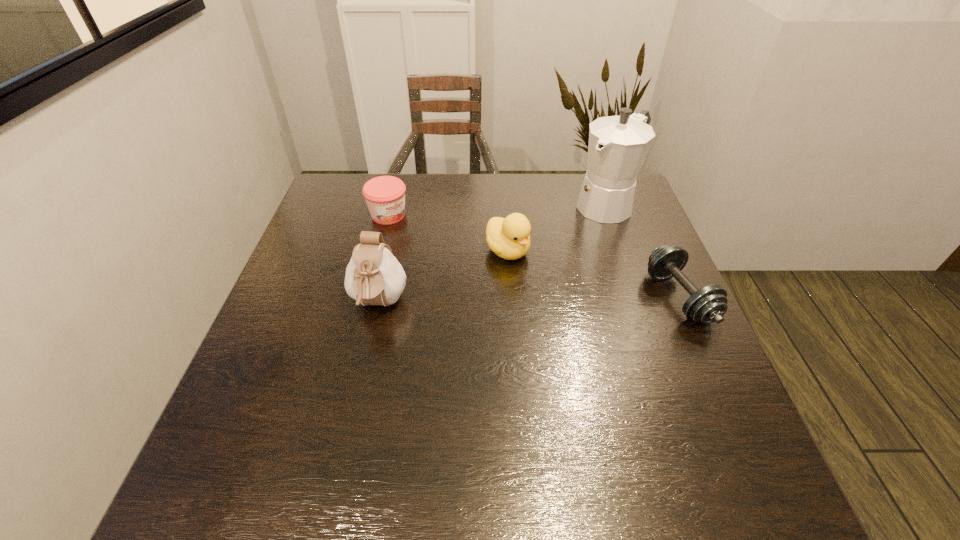
Locate an element on the screen. The image size is (960, 540). pouch is located at coordinates (374, 276).

Find the location of a particular element. The width and height of the screenshot is (960, 540). dumbbell is located at coordinates (706, 305).

Locate an element on the screen. The width and height of the screenshot is (960, 540). jam is located at coordinates (385, 195).

Locate an element on the screen. Image resolution: width=960 pixels, height=540 pixels. coffeepot is located at coordinates (618, 145).

Where is `the third tallest object`? Image resolution: width=960 pixels, height=540 pixels. the third tallest object is located at coordinates (509, 238).

Locate an element on the screen. This screenshot has width=960, height=540. duck is located at coordinates (509, 238).

Where is `free spot located on the front-facing side of the pouch`? This screenshot has width=960, height=540. free spot located on the front-facing side of the pouch is located at coordinates (357, 400).

You are a GUI agent. You are given a task and a screenshot of the screen. Output one action in this format:
    pyautogui.click(x=<x>, y=<y>)
    Task: Click on the vacant space situated 0.360m on the left of the dumbbell
    
    Given the screenshot: What is the action you would take?
    pyautogui.click(x=497, y=298)

The height and width of the screenshot is (540, 960). Find the location of `vacant area situated on the front label of the jam`. vacant area situated on the front label of the jam is located at coordinates (477, 282).

I want to click on free space located on the front label of the jam, so click(464, 272).